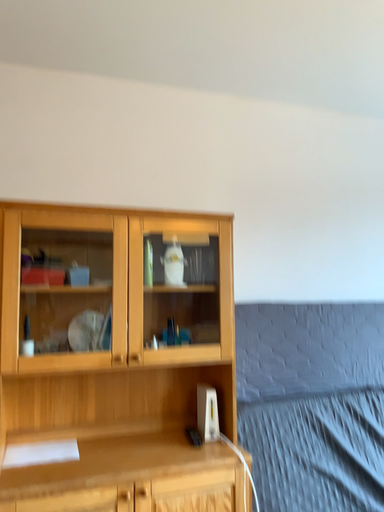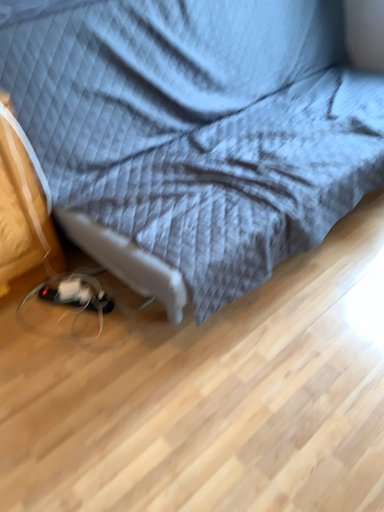
Question: How did the camera likely rotate when shooting the video?

Choices:
 (A) rotated left
 (B) rotated right

Answer: (B)